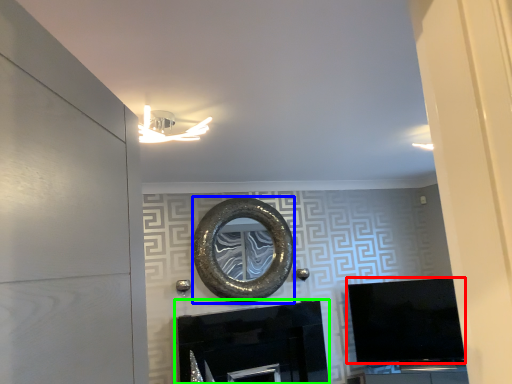
Question: Estimate the real-world distances between objects in this image. Which object is farther from television (highlighted by a red box), oval (highlighted by a blue box) or fireplace (highlighted by a green box)?

Choices:
 (A) oval
 (B) fireplace

Answer: (A)